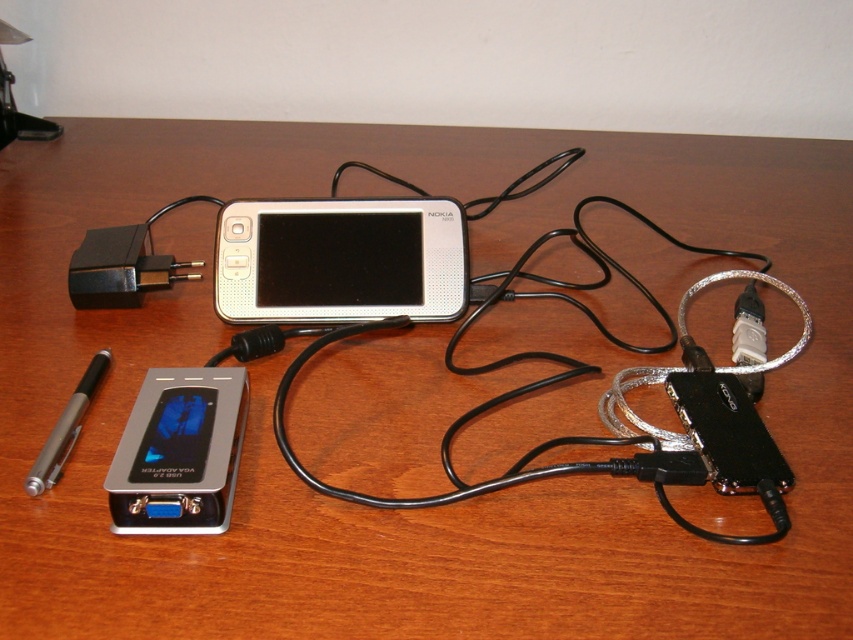
Question: Which of the following is the closest to the observer?

Choices:
 (A) silver metallic vga adapter at lower left
 (B) silver metallic nokia phone at center
 (C) silver metallic pen at lower left

Answer: (A)

Question: Observing the image, what is the correct spatial positioning of silver metallic vga adapter at lower left in reference to silver metallic pen at lower left?

Choices:
 (A) above
 (B) below

Answer: (B)

Question: Considering the relative positions of silver metallic nokia phone at center and silver metallic pen at lower left in the image provided, where is silver metallic nokia phone at center located with respect to silver metallic pen at lower left?

Choices:
 (A) left
 (B) right

Answer: (B)

Question: Among these objects, which one is farthest from the camera?

Choices:
 (A) silver metallic vga adapter at lower left
 (B) silver metallic pen at lower left

Answer: (B)

Question: Which of the following is the farthest from the observer?

Choices:
 (A) (77, 419)
 (B) (144, 468)
 (C) (312, 262)

Answer: (C)

Question: Is silver metallic vga adapter at lower left to the right of silver metallic pen at lower left from the viewer's perspective?

Choices:
 (A) no
 (B) yes

Answer: (B)